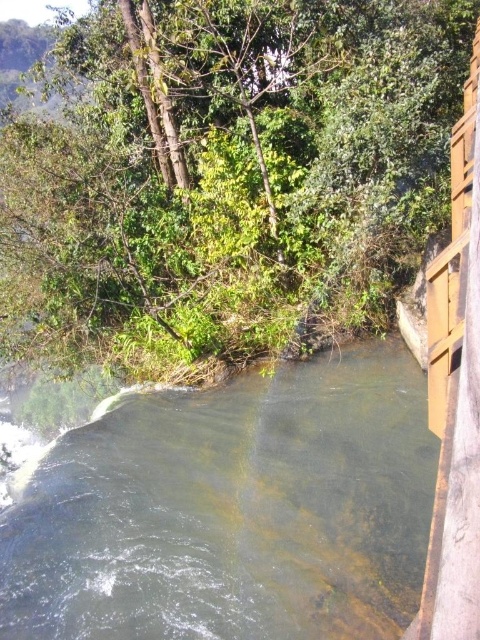
Who is positioned more to the right, green leafy tree at upper left or clear water at center?

clear water at center

Is point (79, 257) positioned after point (395, 552)?

Yes, it is.

Identify the location of green leafy tree at upper left. Image resolution: width=480 pixels, height=640 pixels. (228, 177).